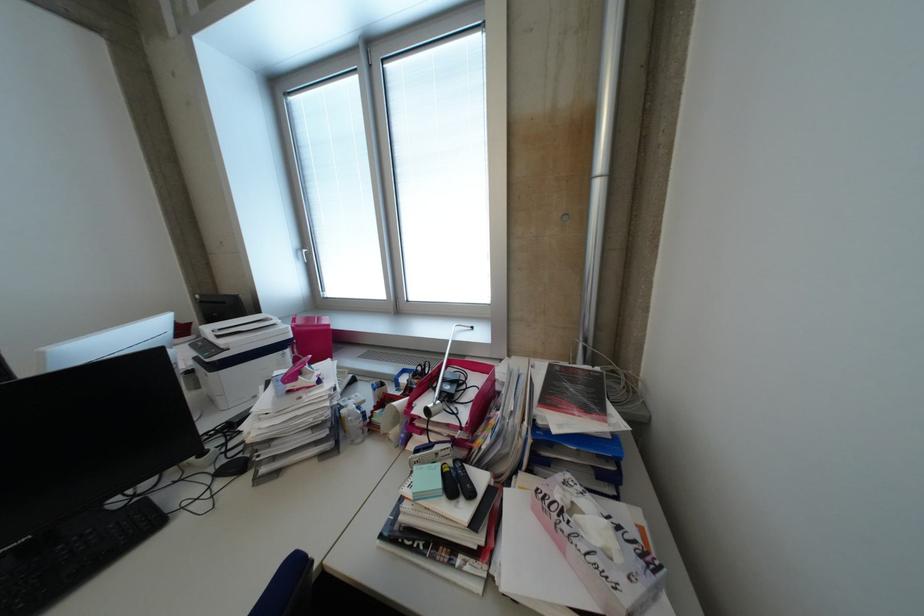
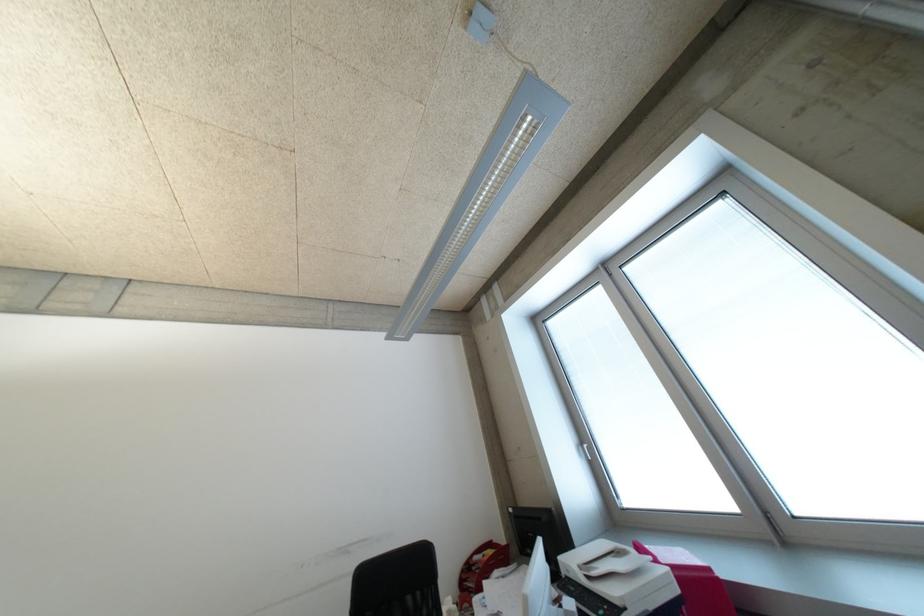
Locate, in the second image, the point that corresponds to the point at 309,254 in the first image.

(589, 450)